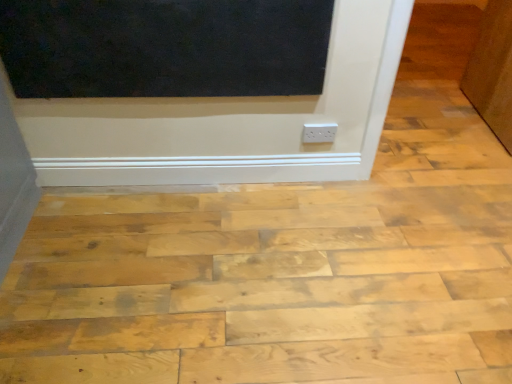
What is the approximate height of matte black screen door at upper center?

16.05 inches.

Measure the distance between white plastic outlet at center and camera.

They are 6.03 feet apart.

You are a GUI agent. You are given a task and a screenshot of the screen. Output one action in this format:
    pyautogui.click(x=<x>, y=<y>)
    Task: Click on the matte black screen door at upper center
    The height and width of the screenshot is (384, 512).
    Given the screenshot: What is the action you would take?
    (x=165, y=47)

Looking at their sizes, would you say natural wood plywood at center is wider or thinner than matte black screen door at upper center?

natural wood plywood at center is wider than matte black screen door at upper center.

Is the depth of natural wood plywood at center less than that of matte black screen door at upper center?

Yes, natural wood plywood at center is in front of matte black screen door at upper center.

From the image's perspective, which one is positioned lower, natural wood plywood at center or matte black screen door at upper center?

From the image's view, natural wood plywood at center is below.

From the picture: Does brown matte door at upper right lie in front of natural wood plywood at center?

That is False.

Find the location of `plywood that is under the brown matte door at upper right (from a real-world perspective)`. plywood that is under the brown matte door at upper right (from a real-world perspective) is located at coordinates (264, 287).

How many degrees apart are the facing directions of brown matte door at upper right and natural wood plywood at center?

They differ by 95.5 degrees in their facing directions.

Could you tell me if brown matte door at upper right is turned towards natural wood plywood at center?

No, brown matte door at upper right is not facing towards natural wood plywood at center.

Is brown matte door at upper right spatially inside white plastic outlet at center, or outside of it?

brown matte door at upper right lies outside white plastic outlet at center.

From the image's perspective, does brown matte door at upper right appear higher than white plastic outlet at center?

Yes, from the image's perspective, brown matte door at upper right is on top of white plastic outlet at center.

Considering the positions of objects brown matte door at upper right and white plastic outlet at center in the image provided, who is behind, brown matte door at upper right or white plastic outlet at center?

white plastic outlet at center.

Is brown matte door at upper right facing towards white plastic outlet at center?

No, brown matte door at upper right is not facing towards white plastic outlet at center.

Locate an element on the screen. This screenshot has width=512, height=384. door lying behind the natural wood plywood at center is located at coordinates (492, 71).

Is natural wood plywood at center outside of brown matte door at upper right?

Yes, natural wood plywood at center is outside of brown matte door at upper right.

From a real-world perspective, is natural wood plywood at center on brown matte door at upper right?

Incorrect, from a real-world perspective, natural wood plywood at center is lower than brown matte door at upper right.

Is brown matte door at upper right to the left of matte black screen door at upper center from the viewer's perspective?

In fact, brown matte door at upper right is to the right of matte black screen door at upper center.

From the picture: From a real-world perspective, is brown matte door at upper right positioned above or below matte black screen door at upper center?

From a real-world perspective, brown matte door at upper right is physically below matte black screen door at upper center.

Are brown matte door at upper right and matte black screen door at upper center making contact?

brown matte door at upper right is not next to matte black screen door at upper center, and they're not touching.

Do you think brown matte door at upper right is within matte black screen door at upper center, or outside of it?

brown matte door at upper right is not inside matte black screen door at upper center, it's outside.

Between natural wood plywood at center and white plastic outlet at center, which one has less height?

With less height is natural wood plywood at center.

Based on the photo, could you tell me if natural wood plywood at center is turned towards white plastic outlet at center?

No, natural wood plywood at center is not oriented towards white plastic outlet at center.

Considering the sizes of objects natural wood plywood at center and white plastic outlet at center in the image provided, who is smaller, natural wood plywood at center or white plastic outlet at center?

Smaller between the two is white plastic outlet at center.

Can you tell me how much natural wood plywood at center and white plastic outlet at center differ in facing direction?

89.5 degrees separate the facing orientations of natural wood plywood at center and white plastic outlet at center.

Relative to brown matte door at upper right, is white plastic outlet at center in front or behind?

In the image, white plastic outlet at center appears behind brown matte door at upper right.

Considering the sizes of objects white plastic outlet at center and brown matte door at upper right in the image provided, who is smaller, white plastic outlet at center or brown matte door at upper right?

Smaller between the two is white plastic outlet at center.

Which is more to the left, white plastic outlet at center or brown matte door at upper right?

From the viewer's perspective, white plastic outlet at center appears more on the left side.

Does white plastic outlet at center have a lesser height compared to brown matte door at upper right?

Indeed, white plastic outlet at center has a lesser height compared to brown matte door at upper right.

In order to click on screen door to the left of natural wood plywood at center in this screenshot , I will do `click(165, 47)`.

The height and width of the screenshot is (384, 512). What are the coordinates of `door behind the natural wood plywood at center` in the screenshot? It's located at (492, 71).

From the image, which object appears to be farther from natural wood plywood at center, matte black screen door at upper center or white plastic outlet at center?

white plastic outlet at center.

From the image, which object appears to be farther from brown matte door at upper right, natural wood plywood at center or white plastic outlet at center?

natural wood plywood at center lies further to brown matte door at upper right than the other object.

When comparing their distances from matte black screen door at upper center, does white plastic outlet at center or brown matte door at upper right seem closer?

white plastic outlet at center is closer to matte black screen door at upper center.

When comparing their distances from white plastic outlet at center, does natural wood plywood at center or matte black screen door at upper center seem further?

Based on the image, natural wood plywood at center appears to be further to white plastic outlet at center.

Considering their positions, is matte black screen door at upper center positioned closer to white plastic outlet at center than brown matte door at upper right?

The object closer to white plastic outlet at center is matte black screen door at upper center.

Based on their spatial positions, is matte black screen door at upper center or white plastic outlet at center closer to brown matte door at upper right?

Among the two, white plastic outlet at center is located nearer to brown matte door at upper right.

Considering their positions, is natural wood plywood at center positioned further to matte black screen door at upper center than white plastic outlet at center?

Based on the image, natural wood plywood at center appears to be further to matte black screen door at upper center.

In the scene shown: When comparing their distances from white plastic outlet at center, does matte black screen door at upper center or natural wood plywood at center seem closer?

The object closer to white plastic outlet at center is matte black screen door at upper center.

Locate an element on the screen. This screenshot has height=384, width=512. electric outlet between matte black screen door at upper center and natural wood plywood at center from top to bottom is located at coordinates (319, 133).

Where is `electric outlet situated between natural wood plywood at center and brown matte door at upper right from left to right`? This screenshot has height=384, width=512. electric outlet situated between natural wood plywood at center and brown matte door at upper right from left to right is located at coordinates (319, 133).

I want to click on electric outlet between matte black screen door at upper center and brown matte door at upper right from left to right, so click(x=319, y=133).

Find the location of `plywood located between matte black screen door at upper center and brown matte door at upper right in the left-right direction`. plywood located between matte black screen door at upper center and brown matte door at upper right in the left-right direction is located at coordinates (264, 287).